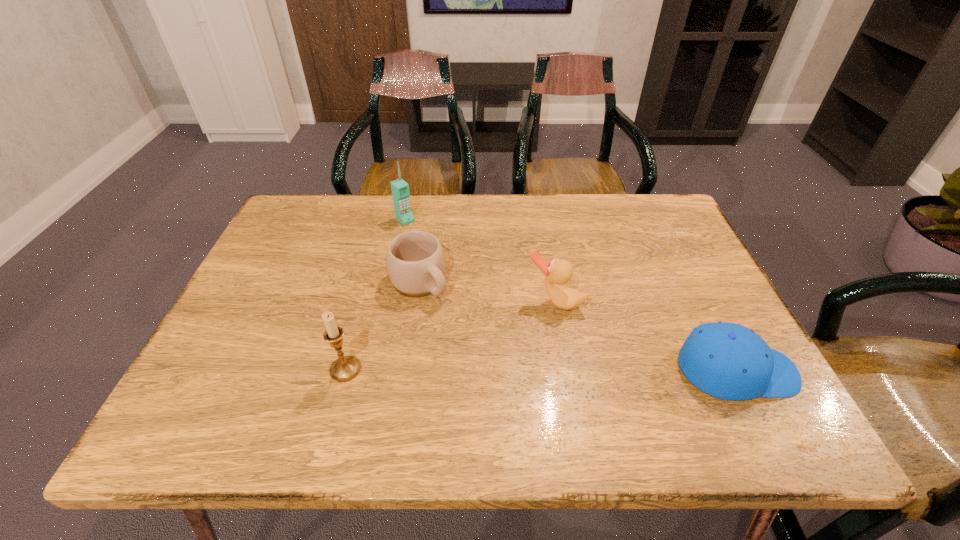
You are a GUI agent. You are given a task and a screenshot of the screen. Output one action in this format:
    pyautogui.click(x=<x>, y=<y>)
    Task: Click on the unoccupied area between the duck and the mug
    
    Given the screenshot: What is the action you would take?
    pyautogui.click(x=488, y=292)

This screenshot has height=540, width=960. I want to click on vacant point located between the duck and the farthest object, so [480, 261].

Locate an element on the screen. This screenshot has height=540, width=960. vacant area that lies between the farthest object and the candle holder is located at coordinates (375, 294).

Identify which object is located as the nearest to the fourth object from left to right. Please provide its 2D coordinates. Your answer should be formatted as a tuple, i.e. [(x, y)], where the tuple contains the x and y coordinates of a point satisfying the conditions above.

[(729, 361)]

You are a GUI agent. You are given a task and a screenshot of the screen. Output one action in this format:
    pyautogui.click(x=<x>, y=<y>)
    Task: Click on the object that is the closest one to the candle holder
    The height and width of the screenshot is (540, 960).
    Given the screenshot: What is the action you would take?
    pyautogui.click(x=415, y=260)

This screenshot has width=960, height=540. Find the location of `free location that satisfies the following two spatial constraints: 1. on the front side of the duck; 2. on the left side of the farthest object`. free location that satisfies the following two spatial constraints: 1. on the front side of the duck; 2. on the left side of the farthest object is located at coordinates (388, 302).

The width and height of the screenshot is (960, 540). In order to click on free space that satisfies the following two spatial constraints: 1. on the front side of the rightmost object; 2. on the front-facing side of the candle holder in this screenshot , I will do `click(346, 371)`.